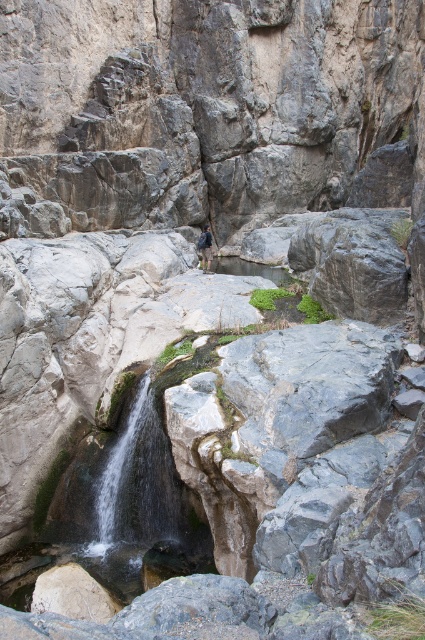
Question: Among these points, which one is farthest from the camera?

Choices:
 (A) (201, 237)
 (B) (132, 464)

Answer: (A)

Question: Does green mossy rock at center have a larger size compared to dark blue backpack at center?

Choices:
 (A) no
 (B) yes

Answer: (B)

Question: Which point appears farthest from the camera in this image?

Choices:
 (A) (206, 232)
 (B) (104, 561)

Answer: (A)

Question: Which object is farther from the camera taking this photo?

Choices:
 (A) green mossy rock at center
 (B) dark blue backpack at center

Answer: (B)

Question: Does green mossy rock at center appear on the right side of dark blue backpack at center?

Choices:
 (A) no
 (B) yes

Answer: (A)

Question: From the image, what is the correct spatial relationship of green mossy rock at center in relation to dark blue backpack at center?

Choices:
 (A) right
 (B) left

Answer: (B)